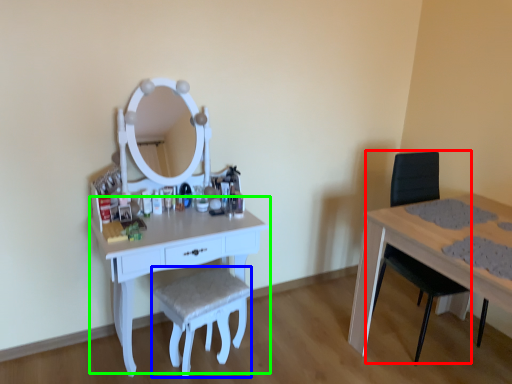
Question: Considering the real-world distances, which object is closest to swivel chair (highlighted by a red box)? stool (highlighted by a blue box) or table (highlighted by a green box).

Choices:
 (A) stool
 (B) table

Answer: (A)